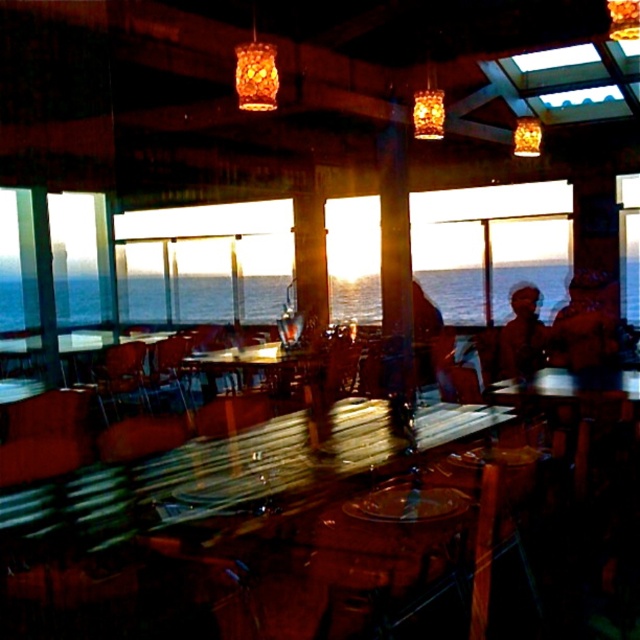
Can you confirm if blue water at center is wider than wooden chair at center?

Indeed, blue water at center has a greater width compared to wooden chair at center.

Is blue water at center positioned at the back of wooden chair at center?

No, it is in front of wooden chair at center.

Measure the distance between point (176,307) and camera.

Point (176,307) is 32.29 feet from camera.

At what (x,y) coordinates should I click in order to perform the action: click on blue water at center. Please return your answer as a coordinate pair (x, y). Looking at the image, I should click on (456, 292).

Is blue water at center to the right of patterned fabric headscarf at center from the viewer's perspective?

Incorrect, blue water at center is not on the right side of patterned fabric headscarf at center.

Looking at this image, who is positioned more to the right, blue water at center or patterned fabric headscarf at center?

Positioned to the right is patterned fabric headscarf at center.

Is point (454, 282) positioned before point (596, 296)?

No.

Identify the location of blue water at center. This screenshot has height=640, width=640. (456, 292).

Is blue water at center to the right of dark brown leather jacket at center from the viewer's perspective?

Incorrect, blue water at center is not on the right side of dark brown leather jacket at center.

Who is more forward, (257, 312) or (506, 326)?

Point (506, 326)

Find the location of a particular element. blue water at center is located at coordinates (456, 292).